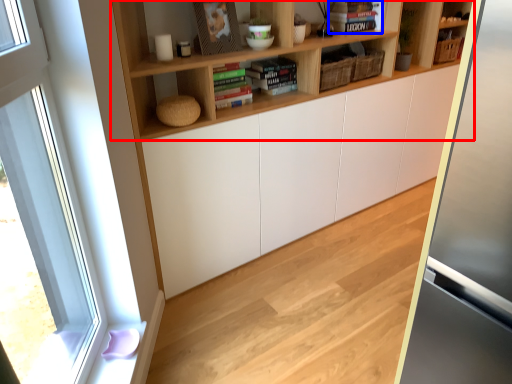
Question: Which object appears closest to the camera in this image, shelf (highlighted by a red box) or book (highlighted by a blue box)?

Choices:
 (A) shelf
 (B) book

Answer: (A)